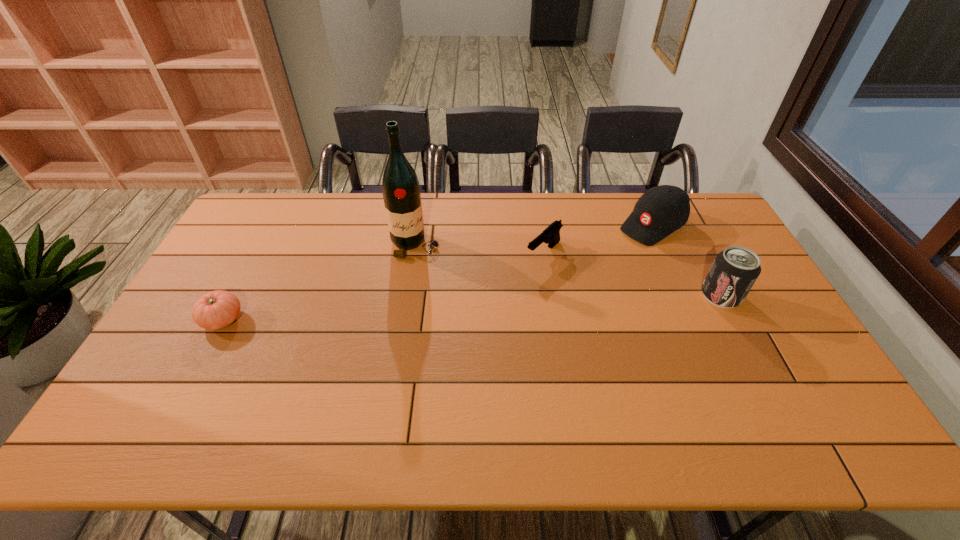
Locate an element on the screen. the leftmost object is located at coordinates (217, 309).

Identify the location of soda can. This screenshot has width=960, height=540. [x=734, y=271].

The width and height of the screenshot is (960, 540). Find the location of `pistol`. pistol is located at coordinates (551, 235).

Where is `the fourth object from right to left`? the fourth object from right to left is located at coordinates 400,187.

This screenshot has height=540, width=960. In order to click on wine bottle in this screenshot , I will do `click(400, 187)`.

You are a GUI agent. You are given a task and a screenshot of the screen. Output one action in this format:
    pyautogui.click(x=<x>, y=<y>)
    Task: Click on the third shortest object
    
    Given the screenshot: What is the action you would take?
    pyautogui.click(x=661, y=210)

Image resolution: width=960 pixels, height=540 pixels. Find the location of `free region located 0.140m on the back of the leftmost object`. free region located 0.140m on the back of the leftmost object is located at coordinates (249, 271).

Where is `vacant area situated on the back of the soda can`? vacant area situated on the back of the soda can is located at coordinates (694, 244).

At what (x,y) coordinates should I click in order to perform the action: click on vacant space located on the front-facing side of the third object from right to left. Please return your answer as a coordinate pair (x, y). Looking at the image, I should click on (456, 332).

Identify the location of blank area located on the front-facing side of the third object from right to left. The height and width of the screenshot is (540, 960). (519, 276).